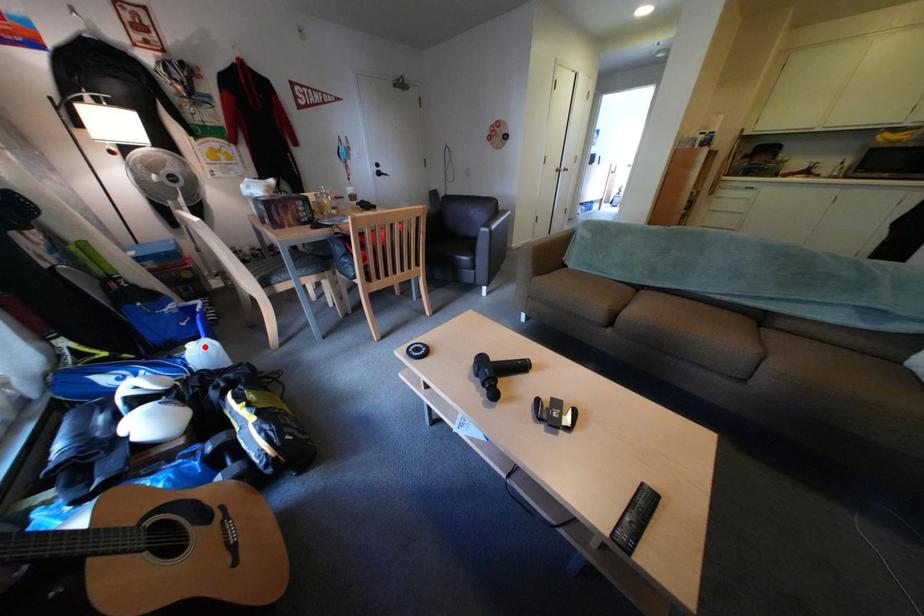
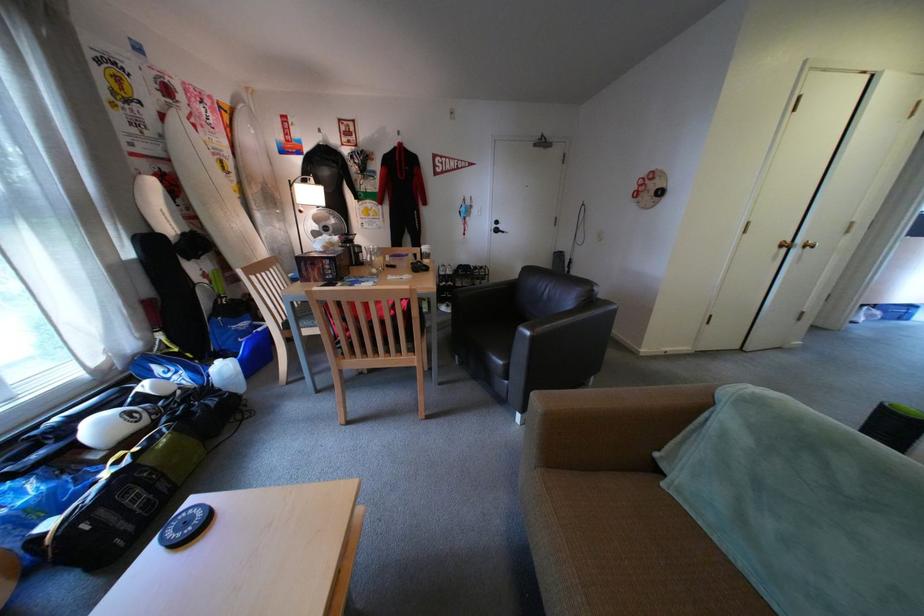
Locate, in the second image, the point that corresponds to the highlighted location in the first image.

(233, 363)